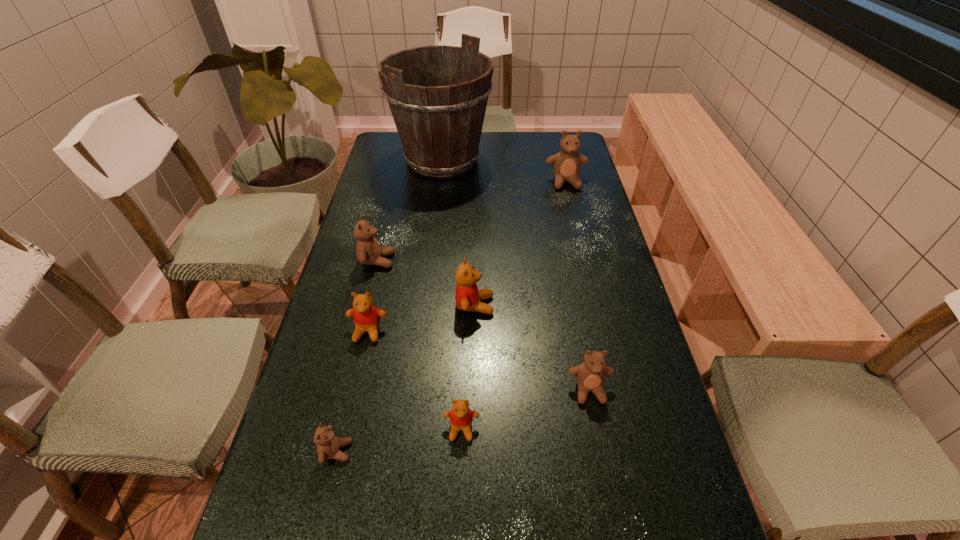
Identify the location of free space in the image that satisfies the following two spatial constraints: 1. on the front-facing side of the second nearest brown teddy bear; 2. on the front-facing side of the nearest brown teddy bear. (601, 451).

Find the location of a particular element. The image size is (960, 540). free point that satisfies the following two spatial constraints: 1. on the front-facing side of the nearest red teddy bear; 2. on the front-facing side of the smallest brown teddy bear is located at coordinates (461, 451).

Locate an element on the screen. blank area in the image that satisfies the following two spatial constraints: 1. on the front-facing side of the biggest red teddy bear; 2. on the front-facing side of the leftmost red teddy bear is located at coordinates (474, 331).